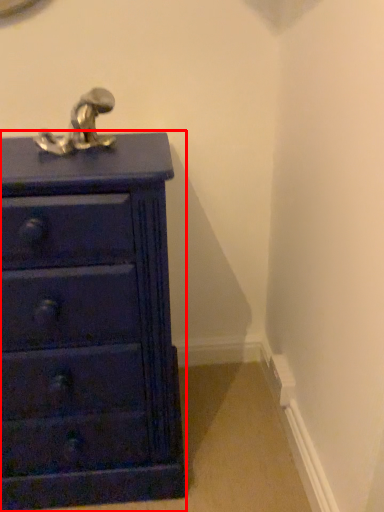
Question: Considering the relative positions of chest of drawers (annotated by the red box) and tap in the image provided, where is chest of drawers (annotated by the red box) located with respect to the staircase?

Choices:
 (A) right
 (B) left

Answer: (B)